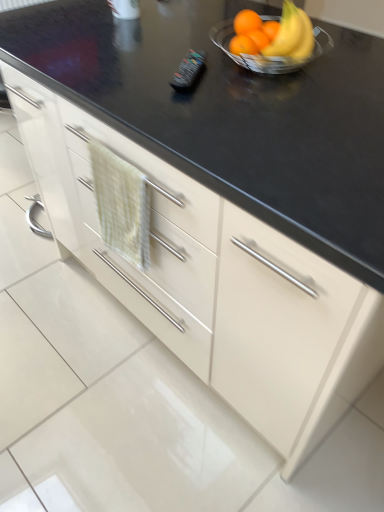
Locate an element on the screen. The height and width of the screenshot is (512, 384). vacant space to the left of black plastic remote control at center is located at coordinates (131, 71).